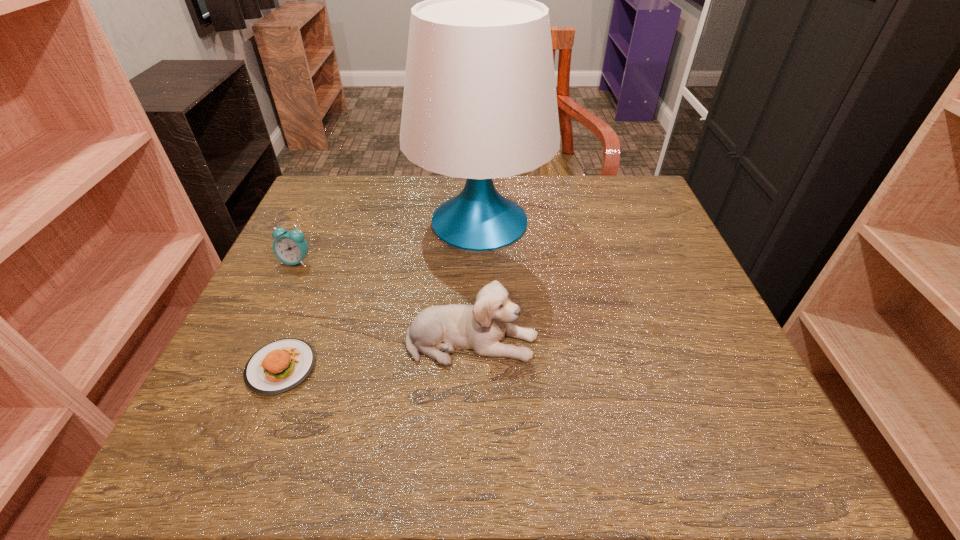
You are a GUI agent. You are given a task and a screenshot of the screen. Output one action in this format:
    pyautogui.click(x=<x>, y=<y>)
    Task: Click on the table lamp
    The height and width of the screenshot is (540, 960).
    Given the screenshot: What is the action you would take?
    pyautogui.click(x=479, y=102)

The height and width of the screenshot is (540, 960). What are the coordinates of `puppy` in the screenshot? It's located at (436, 331).

The width and height of the screenshot is (960, 540). I want to click on the third tallest object, so click(x=290, y=247).

Identify the location of the shortest object. The width and height of the screenshot is (960, 540). (281, 365).

The image size is (960, 540). What are the coordinates of `vacant space located on the front-facing side of the tallest object` in the screenshot? It's located at (654, 220).

What are the coordinates of `free space located 0.350m on the front-facing side of the puppy` in the screenshot? It's located at (727, 341).

Find the location of a particular element. This screenshot has width=960, height=540. vacant space located 0.340m on the face of the third tallest object is located at coordinates (228, 408).

Locate an element on the screen. The height and width of the screenshot is (540, 960). vacant space located on the back of the shortest object is located at coordinates point(302,313).

The image size is (960, 540). Find the location of `object situated at the far edge`. object situated at the far edge is located at coordinates (479, 102).

I want to click on alarm clock that is at the left edge, so click(x=290, y=247).